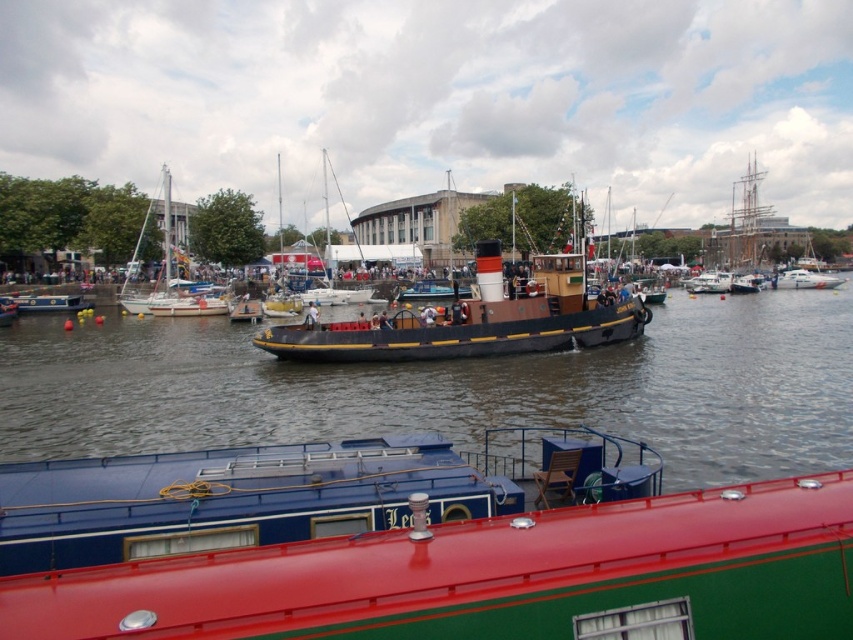
Between white sailboat at left and matte black boat at center, which one has more height?

white sailboat at left is taller.

Does white sailboat at left have a lesser height compared to matte black boat at center?

Incorrect, white sailboat at left's height does not fall short of matte black boat at center's.

Who is more distant from viewer, (x=170, y=236) or (x=9, y=324)?

Positioned behind is point (x=170, y=236).

The width and height of the screenshot is (853, 640). Identify the location of white sailboat at left. (173, 269).

Between white sailboat at left and white glossy boat at right, which one is positioned lower?

white glossy boat at right

In the scene shown: Between white sailboat at left and white glossy boat at right, which one appears on the right side from the viewer's perspective?

white glossy boat at right

You are a GUI agent. You are given a task and a screenshot of the screen. Output one action in this format:
    pyautogui.click(x=<x>, y=<y>)
    Task: Click on the white sailboat at left
    The image size is (853, 640).
    Given the screenshot: What is the action you would take?
    pyautogui.click(x=173, y=269)

Locate an element on the screen. Image resolution: width=853 pixels, height=640 pixels. white sailboat at left is located at coordinates (173, 269).

Find the location of `wooden sailboat at center`. wooden sailboat at center is located at coordinates point(332,259).

Between wooden sailboat at center and matte black boat at center, which one has more height?

wooden sailboat at center is taller.

Who is more forward, (329,170) or (16,314)?

Point (16,314) is more forward.

Locate an element on the screen. This screenshot has height=640, width=853. wooden sailboat at center is located at coordinates (332, 259).